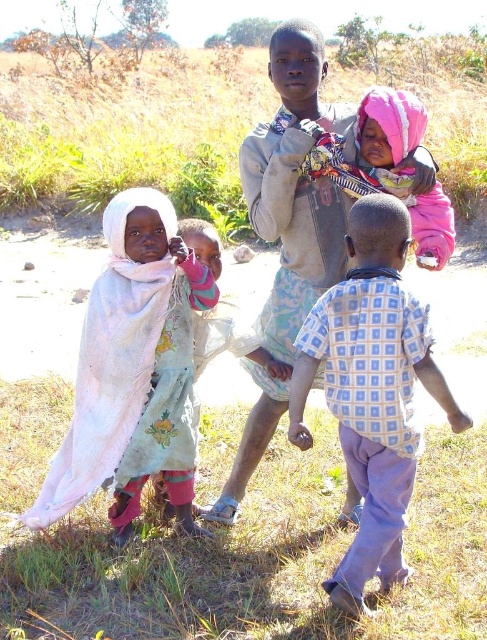
Question: Which point is closer to the camera?

Choices:
 (A) pink fabric scarf at upper center
 (B) blue checkered shirt at center

Answer: (B)

Question: Does blue checkered shirt at center have a smaller size compared to pink fabric scarf at upper center?

Choices:
 (A) no
 (B) yes

Answer: (A)

Question: Is blue checkered shirt at center thinner than pink fabric scarf at upper center?

Choices:
 (A) no
 (B) yes

Answer: (A)

Question: Which point is closer to the camera taking this photo?

Choices:
 (A) (400, 429)
 (B) (416, 172)

Answer: (A)

Question: Is blue checkered shirt at center in front of pink fabric scarf at upper center?

Choices:
 (A) no
 (B) yes

Answer: (B)